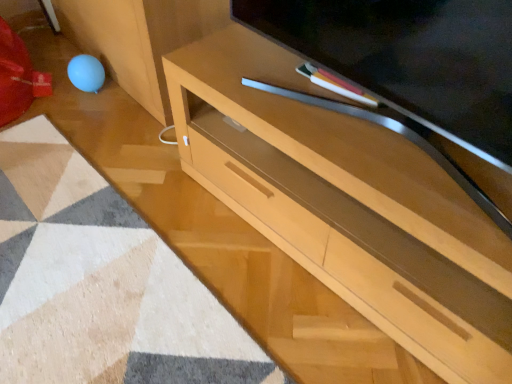
Question: From the image's perspective, is light wood desk at center above matte wood television at center?

Choices:
 (A) yes
 (B) no

Answer: (B)

Question: Does light wood desk at center have a greater height compared to matte wood television at center?

Choices:
 (A) yes
 (B) no

Answer: (A)

Question: Are light wood desk at center and matte wood television at center located far from each other?

Choices:
 (A) no
 (B) yes

Answer: (A)

Question: From the image's perspective, is light wood desk at center located beneath matte wood television at center?

Choices:
 (A) yes
 (B) no

Answer: (A)

Question: Considering the relative positions of light wood desk at center and matte wood television at center in the image provided, is light wood desk at center to the left of matte wood television at center from the viewer's perspective?

Choices:
 (A) no
 (B) yes

Answer: (A)

Question: Looking at their shapes, would you say beige textured mat at lower left is wider or thinner than matte wood television at center?

Choices:
 (A) thin
 (B) wide

Answer: (B)

Question: Is point pos(53,254) positioned closer to the camera than point pos(339,31)?

Choices:
 (A) closer
 (B) farther

Answer: (B)

Question: Considering the positions of beige textured mat at lower left and matte wood television at center in the image, is beige textured mat at lower left taller or shorter than matte wood television at center?

Choices:
 (A) tall
 (B) short

Answer: (B)

Question: Is beige textured mat at lower left inside or outside of matte wood television at center?

Choices:
 (A) inside
 (B) outside

Answer: (B)

Question: Is beige textured mat at lower left wider or thinner than light wood desk at center?

Choices:
 (A) thin
 (B) wide

Answer: (B)

Question: Based on their sizes in the image, would you say beige textured mat at lower left is bigger or smaller than light wood desk at center?

Choices:
 (A) big
 (B) small

Answer: (B)

Question: Based on their positions, is beige textured mat at lower left located to the left or right of light wood desk at center?

Choices:
 (A) right
 (B) left

Answer: (B)

Question: From a real-world perspective, is beige textured mat at lower left physically located above or below light wood desk at center?

Choices:
 (A) below
 (B) above

Answer: (A)

Question: In terms of height, does matte wood television at center look taller or shorter compared to light wood desk at center?

Choices:
 (A) tall
 (B) short

Answer: (B)

Question: Considering the positions of matte wood television at center and light wood desk at center in the image, is matte wood television at center wider or thinner than light wood desk at center?

Choices:
 (A) thin
 (B) wide

Answer: (A)